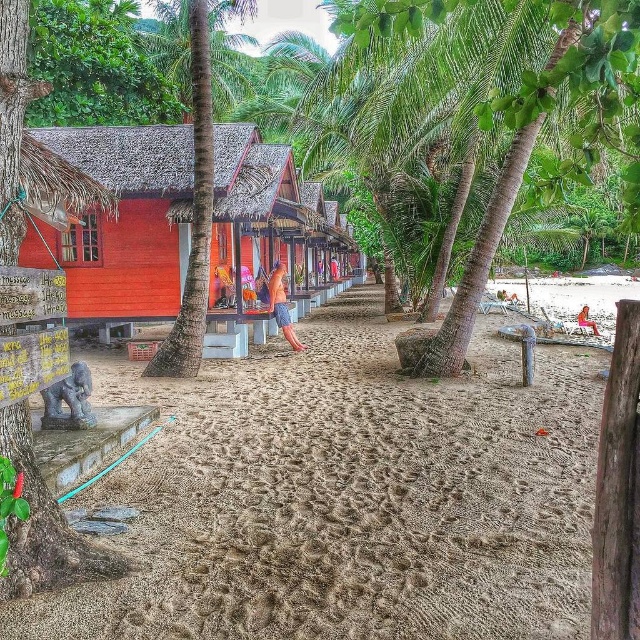
You are a photographer standing at the edge of the beach. You want to take a photo that includes both the green leafy palm tree at center and the smooth tan skin at center. Based on their positions, which object should you place on the left side of your frame to ensure both are visible?

The green leafy palm tree at center should be placed on the left side of your frame because it is positioned on the left side of the smooth tan skin at center.

You are a guest staying at the tropical resort and want to walk from your current position to the beach. You see the matte red wooden hut at center and the smooth tan skin at center. How far apart are these two landmarks?

The matte red wooden hut at center and the smooth tan skin at center are 3.94 meters apart.